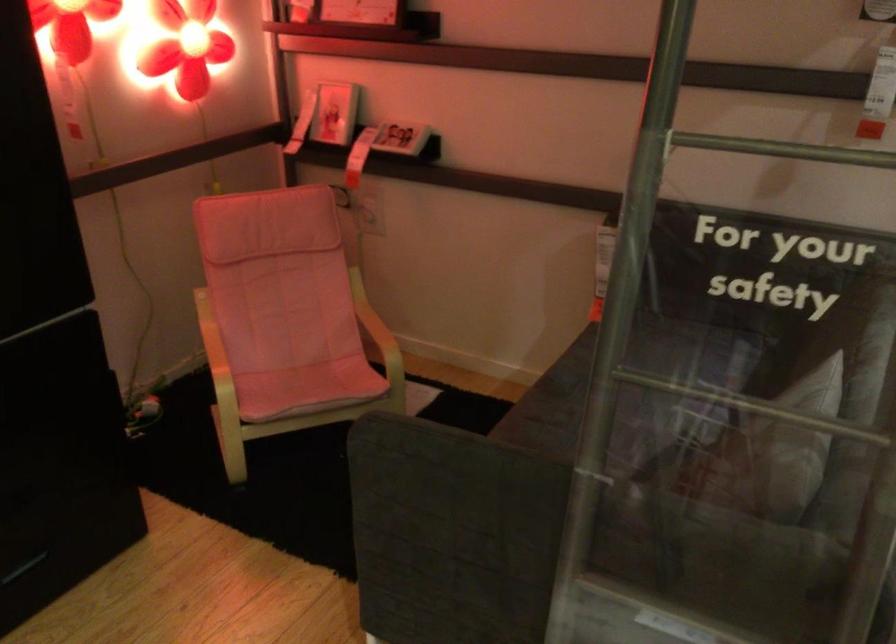
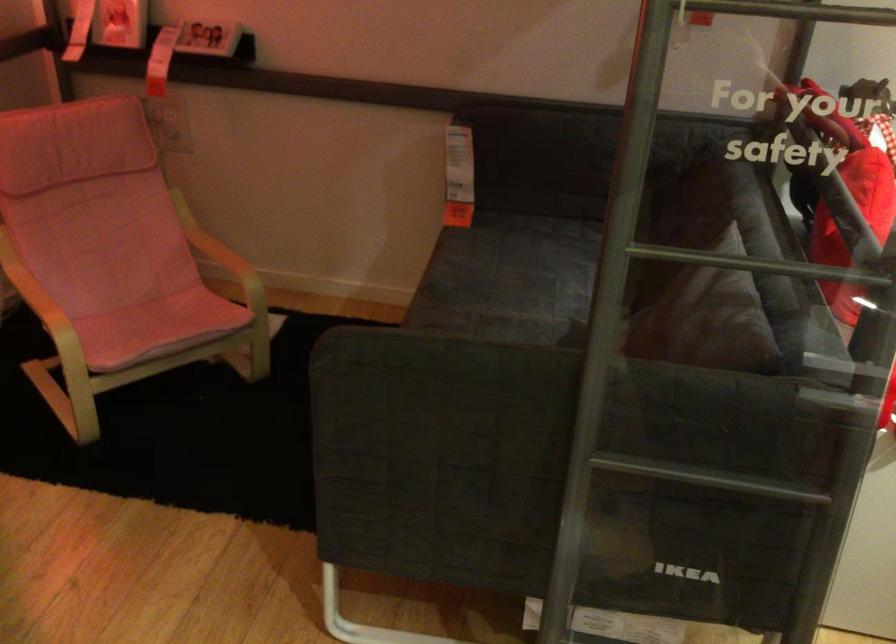
The images are taken continuously from a first-person perspective. In which direction are you moving?

The cameraman walked toward left, forward.